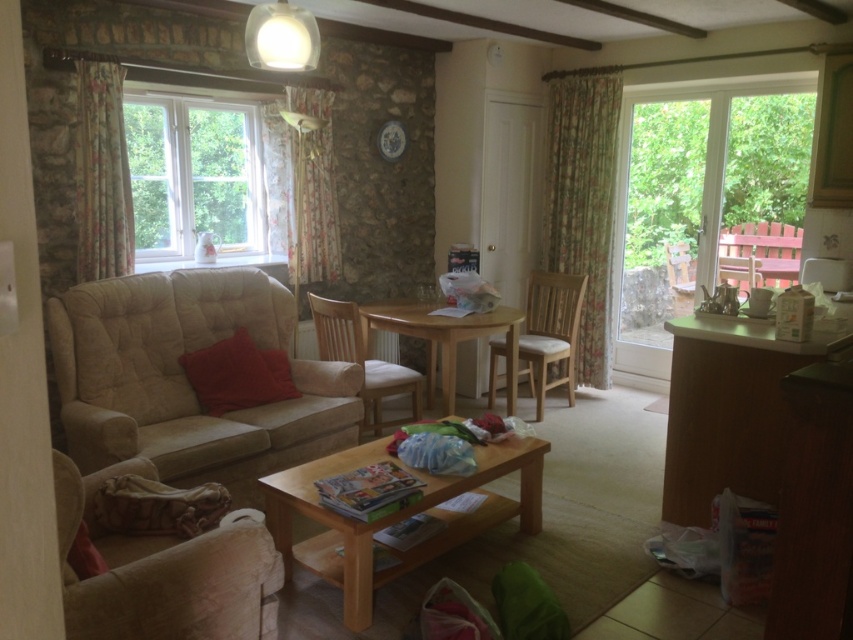
You are sitting on the beige fabric armchair at lower left and want to reach the wooden chair at right. Which direction should you move to get there?

The beige fabric armchair at lower left is located below the wooden chair at right, so you should move upward to reach it.

You are standing at the entrance of the living room and see two points marked in the image. The first point is located at coordinate point (254, 536) and the second point is at coordinate point (688, 246). If you want to walk from the entrance to the second point, will you pass through the first point along the shortest path?

Point (254, 536) is in front of point (688, 246), so yes, walking from the entrance to the second point would require passing through the first point along the shortest path.